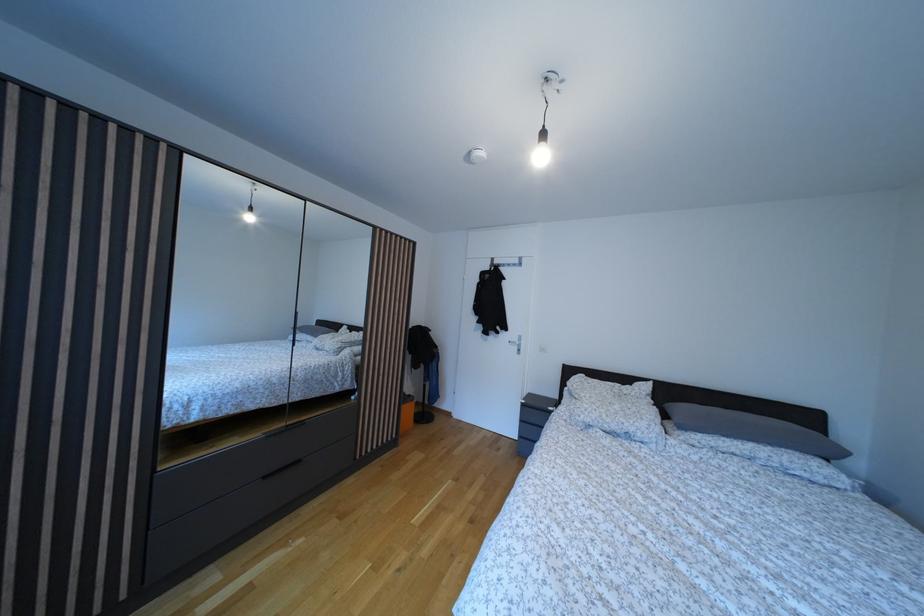
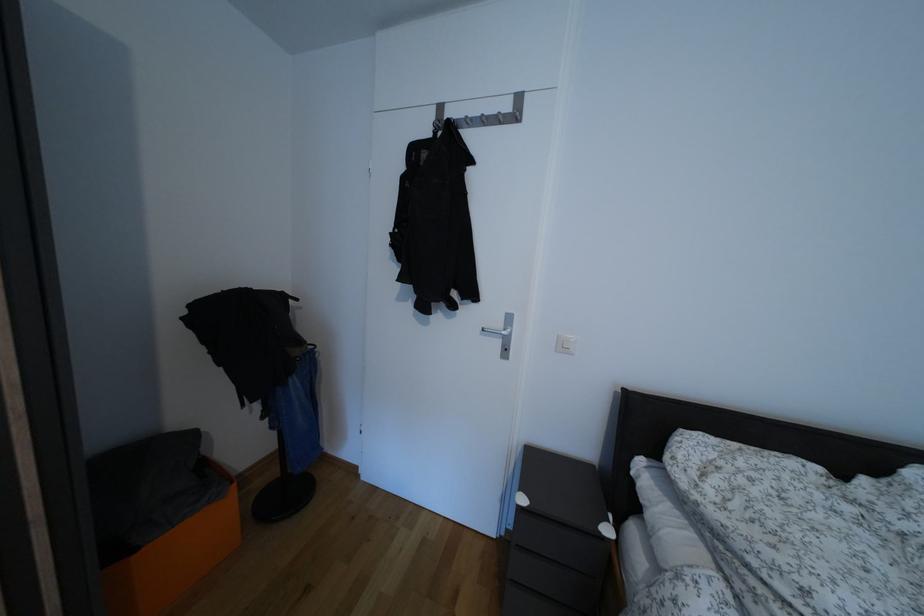
Question: What movement of the cameraman would produce the second image?

Choices:
 (A) Left
 (B) Right
 (C) Forward
 (D) Backward

Answer: (C)